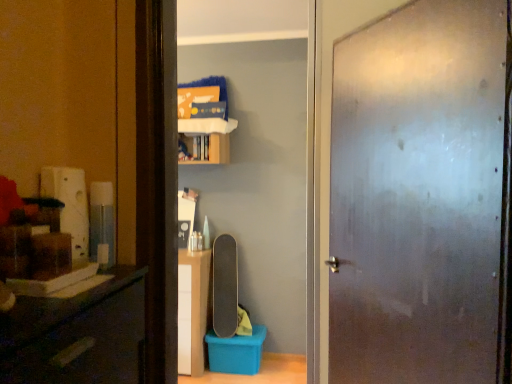
Question: Does point (225, 248) appear closer or farther from the camera than point (467, 302)?

Choices:
 (A) farther
 (B) closer

Answer: (A)

Question: Relative to frosted glass door at center, is smooth black skateboard at center in front or behind?

Choices:
 (A) front
 (B) behind

Answer: (B)

Question: Estimate the real-world distances between objects in this image. Which object is farther from the smooth black skateboard at center?

Choices:
 (A) frosted glass door at center
 (B) wooden cabinet at upper center

Answer: (A)

Question: Estimate the real-world distances between objects in this image. Which object is farther from the frosted glass door at center?

Choices:
 (A) smooth black skateboard at center
 (B) wooden cabinet at upper center

Answer: (A)